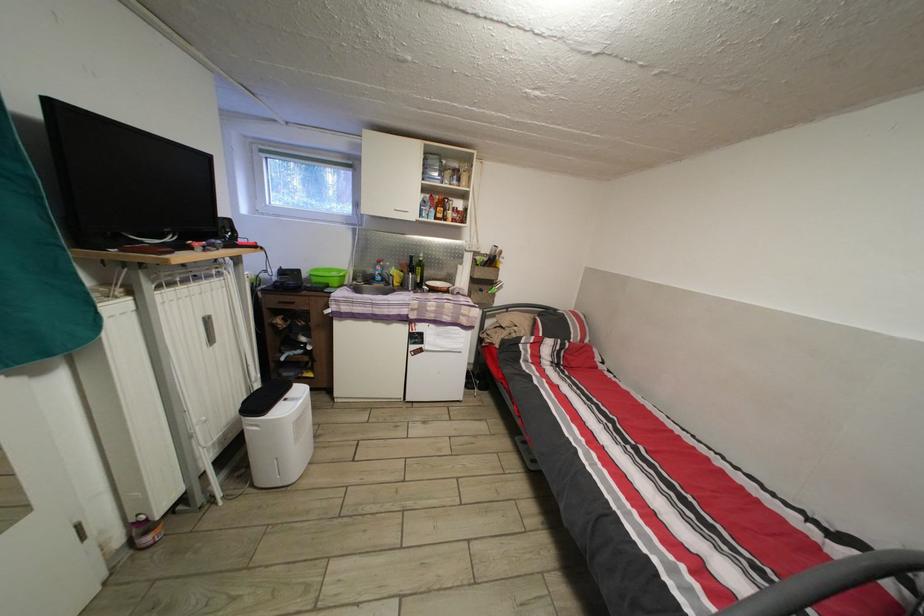
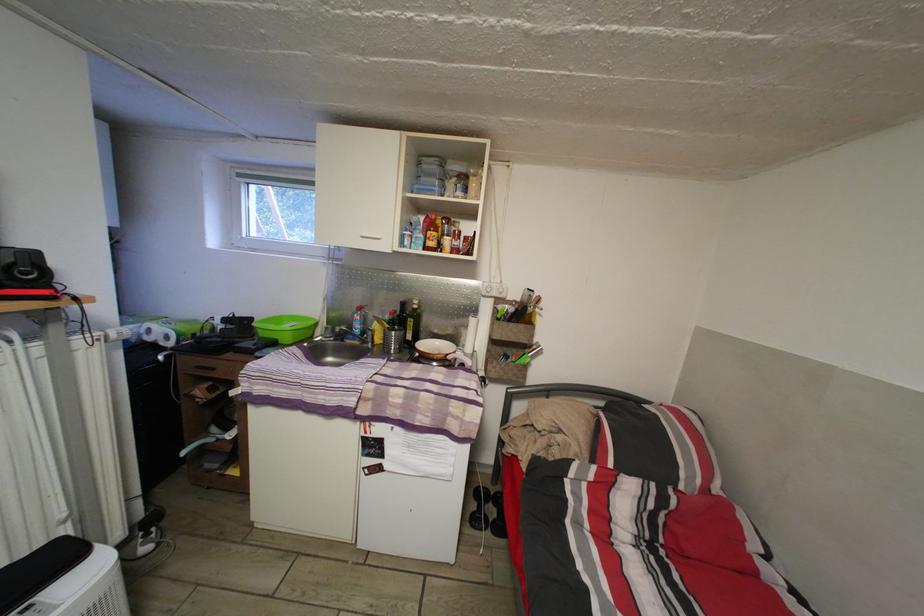
Where in the second image is the point corresponding to pixel 306 277 from the first image?

(257, 326)